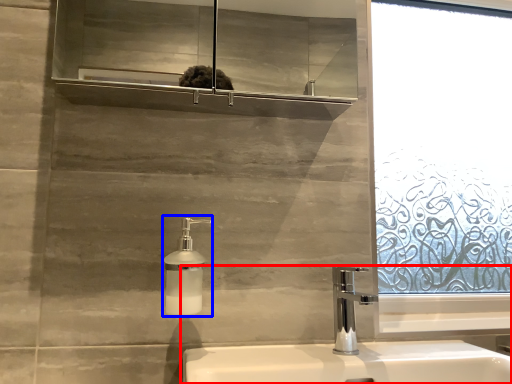
Question: Which of the following is the farthest to the observer, sink (highlighted by a red box) or soap dispenser (highlighted by a blue box)?

Choices:
 (A) sink
 (B) soap dispenser

Answer: (B)